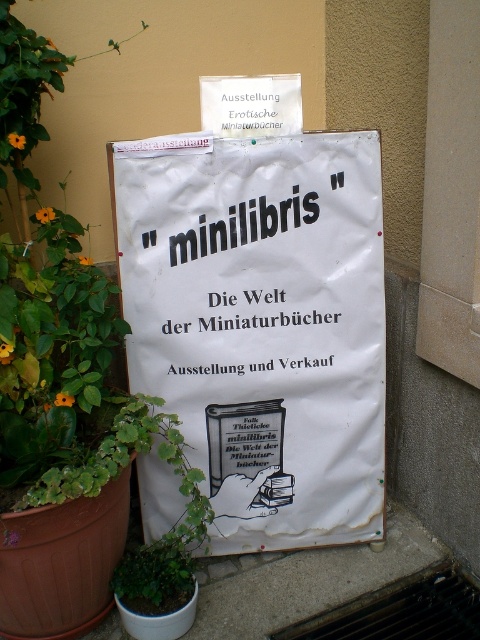
You are standing in front of the white paper sign at center. If you want to read the text on it clearly, do you need to move closer or farther away?

The white paper sign at center is 1.64 meters from camera, so you can read the text clearly without needing to move closer or farther away.

You are an event planner organizing a book fair and need to place a 1.2 meter wide banner. You see the white paper sign at center and the green leafy plant at lower left in the image. Which object can accommodate the banner without overlapping?

The white paper sign at center has a larger size compared to the green leafy plant at lower left, so the banner can be placed near the white paper sign at center without overlapping.